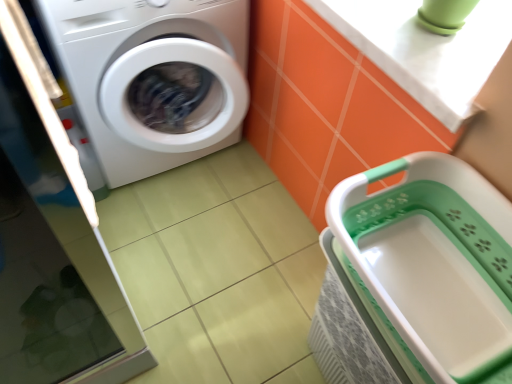
Question: From the image's perspective, does white glossy washing machine at left appear lower than white glossy counter top at upper right?

Choices:
 (A) yes
 (B) no

Answer: (B)

Question: Can white glossy counter top at upper right be found inside white glossy washing machine at left?

Choices:
 (A) no
 (B) yes

Answer: (A)

Question: Is white glossy washing machine at left aimed at white glossy counter top at upper right?

Choices:
 (A) no
 (B) yes

Answer: (A)

Question: Can you confirm if white glossy washing machine at left is thinner than white glossy counter top at upper right?

Choices:
 (A) no
 (B) yes

Answer: (A)

Question: Can you confirm if white glossy washing machine at left is bigger than white glossy counter top at upper right?

Choices:
 (A) yes
 (B) no

Answer: (A)

Question: Choose the correct answer: Is white glossy washing machine at left inside white plastic basket at lower right or outside it?

Choices:
 (A) inside
 (B) outside

Answer: (B)

Question: From a real-world perspective, is white glossy washing machine at left above or below white plastic basket at lower right?

Choices:
 (A) above
 (B) below

Answer: (B)

Question: Is point (70, 76) positioned closer to the camera than point (409, 284)?

Choices:
 (A) closer
 (B) farther

Answer: (B)

Question: From the image's perspective, is white glossy washing machine at left positioned above or below white plastic basket at lower right?

Choices:
 (A) above
 (B) below

Answer: (A)

Question: In the image, is white glossy counter top at upper right on the left side or the right side of white plastic basket at lower right?

Choices:
 (A) left
 (B) right

Answer: (B)

Question: Is white glossy counter top at upper right inside the boundaries of white plastic basket at lower right, or outside?

Choices:
 (A) outside
 (B) inside

Answer: (A)

Question: In terms of height, does white glossy counter top at upper right look taller or shorter compared to white plastic basket at lower right?

Choices:
 (A) short
 (B) tall

Answer: (A)

Question: Is white glossy counter top at upper right wider or thinner than white plastic basket at lower right?

Choices:
 (A) wide
 (B) thin

Answer: (A)

Question: Is white glossy counter top at upper right wider or thinner than white glossy washing machine at left?

Choices:
 (A) thin
 (B) wide

Answer: (A)

Question: From their relative heights in the image, would you say white glossy counter top at upper right is taller or shorter than white glossy washing machine at left?

Choices:
 (A) tall
 (B) short

Answer: (B)